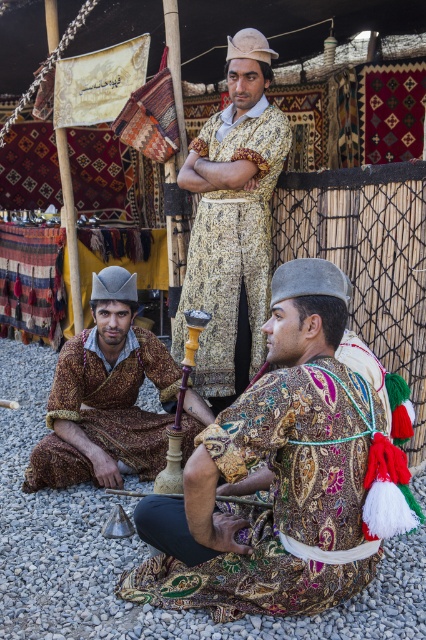
You are a photographer at the event and need to capture a photo of both the patterned fabric man at center and the matte brown robe at lower left. Which of the two should you focus on first if you want to include both in the frame without moving the camera?

The patterned fabric man at center is positioned on the right side of matte brown robe at lower left. Therefore, to include both in the frame without moving the camera, you should focus on the matte brown robe at lower left first, as it is closer to the left side and adjusting the camera angle to include the right side subject would require ensuring both are within the frame.

You are an event planner arranging seating for a ceremony under the tent. You need to place two chairs next to the patterned fabric man at center and the matte brown robe at lower left. Which chair should be wider to accommodate the width of the person?

The chair next to the matte brown robe at lower left should be wider because the matte brown robe at lower left has a greater width than the patterned fabric man at center.